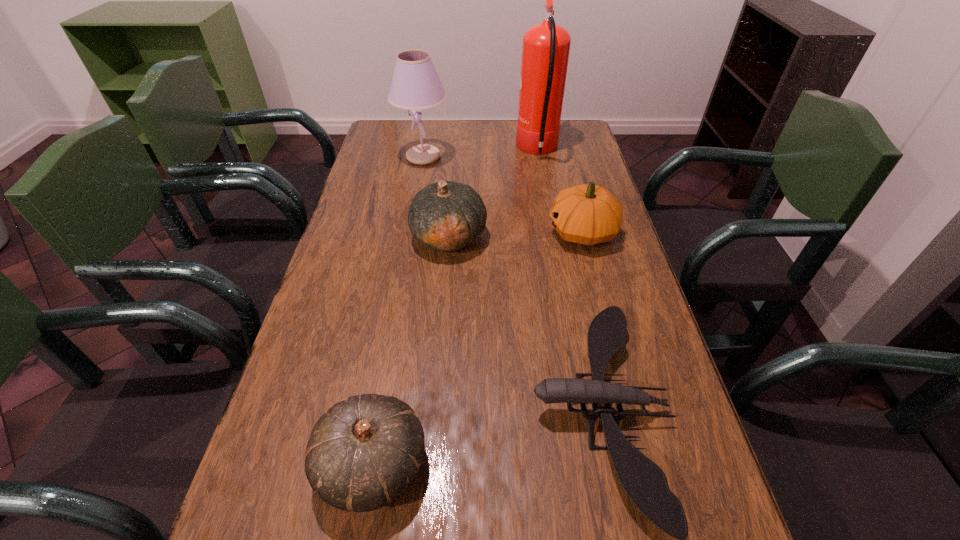
Locate an element on the screen. Image resolution: width=960 pixels, height=540 pixels. vacant space at the far edge of the desktop is located at coordinates coord(490,138).

Locate an element on the screen. This screenshot has height=540, width=960. vacant space at the left edge of the desktop is located at coordinates (246, 495).

The image size is (960, 540). What are the coordinates of `free point at the right edge` in the screenshot? It's located at (687, 449).

The width and height of the screenshot is (960, 540). In order to click on vacant space at the far left corner in this screenshot , I will do `click(416, 127)`.

The width and height of the screenshot is (960, 540). Find the location of `empty space between the lampshade and the rightmost gourd`. empty space between the lampshade and the rightmost gourd is located at coordinates (503, 194).

Identify the location of empty space between the tallest object and the lampshade. The width and height of the screenshot is (960, 540). (481, 153).

Where is `unoccupied area between the second tallest object and the tallest object`? unoccupied area between the second tallest object and the tallest object is located at coordinates (481, 153).

Identify which object is located as the fifth nearest to the nearest gourd. Please provide its 2D coordinates. Your answer should be formatted as a tuple, i.e. [(x, y)], where the tuple contains the x and y coordinates of a point satisfying the conditions above.

[(545, 48)]

The width and height of the screenshot is (960, 540). In order to click on object that stands as the fourth closest to the nearest gourd in this screenshot , I will do `click(415, 85)`.

This screenshot has height=540, width=960. I want to click on gourd identified as the closest to the lampshade, so click(x=445, y=216).